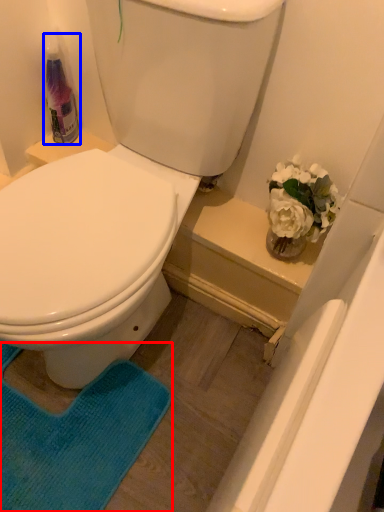
Question: Which of the following is the farthest to the observer, yoga mat (highlighted by a red box) or cleaning product (highlighted by a blue box)?

Choices:
 (A) yoga mat
 (B) cleaning product

Answer: (B)